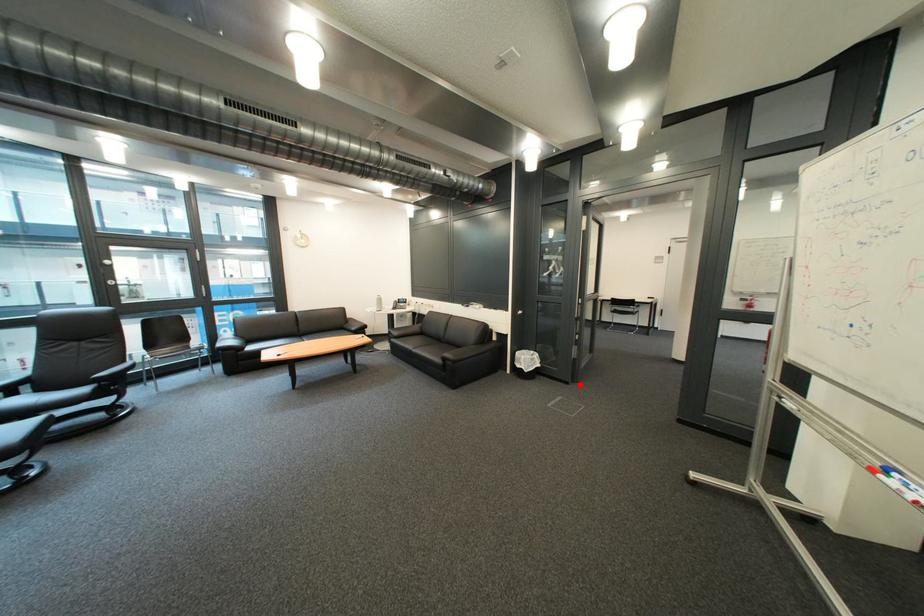
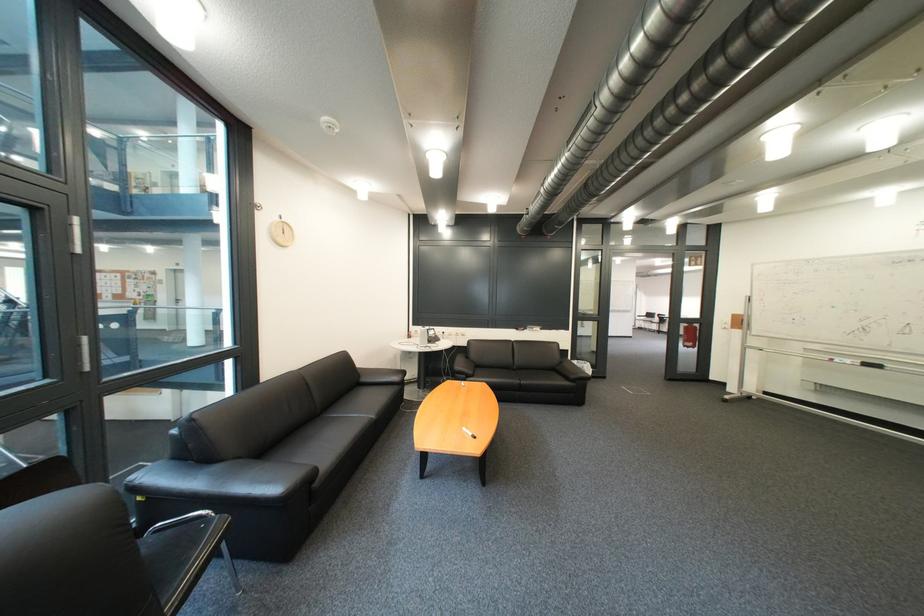
The point at the highlighted location is marked in the first image. Where is the corresponding point in the second image?

(618, 379)